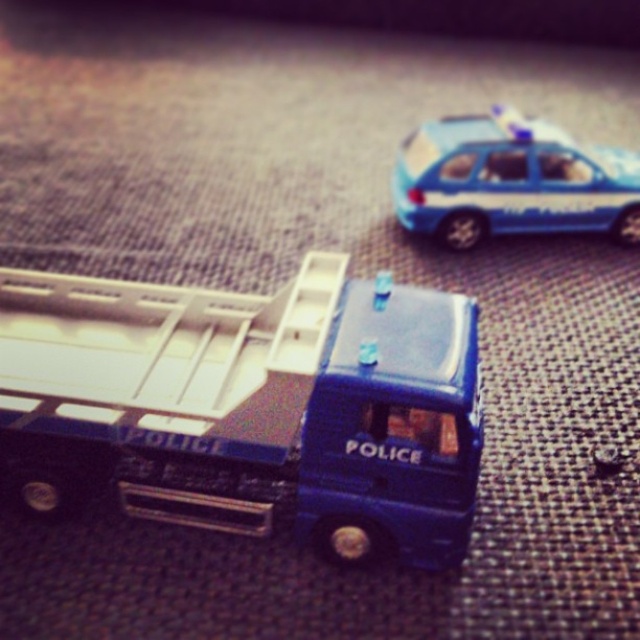
In the scene shown: You are a child who wants to play with both the blue metallic truck at center and the blue plastic car at upper right. If you want to pick up the smaller one first, which toy should you choose?

The blue plastic car at upper right is smaller in size than the blue metallic truck at center, so you should pick up the blue plastic car at upper right first.

You are organizing a toy collection and want to place the blue metallic truck at center and the blue plastic car at upper right on a shelf. If the shelf has limited space, which toy should you place first to ensure both fit properly?

The blue metallic truck at center should be placed first because it is positioned on the left side of the blue plastic car at upper right, indicating it occupies more space to the left and needs to be positioned first to accommodate both on the shelf.

You are a child trying to stack the blue metallic truck at center and the blue plastic car at upper right on top of each other. Which one should you place at the bottom to ensure stability?

The blue metallic truck at center has a greater height compared to the blue plastic car at upper right, so placing the blue metallic truck at center at the bottom would provide a more stable base for the stack.